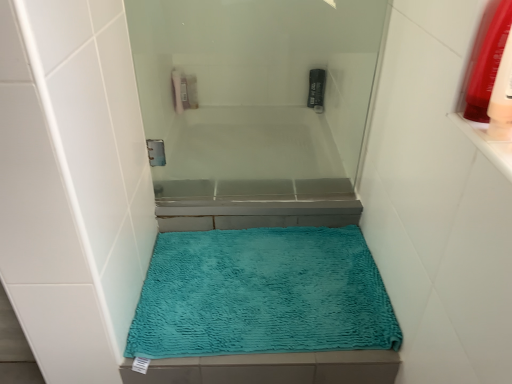
Locate an element on the screen. empty space that is ontop of teal plush bath mat at center (from a real-world perspective) is located at coordinates (254, 278).